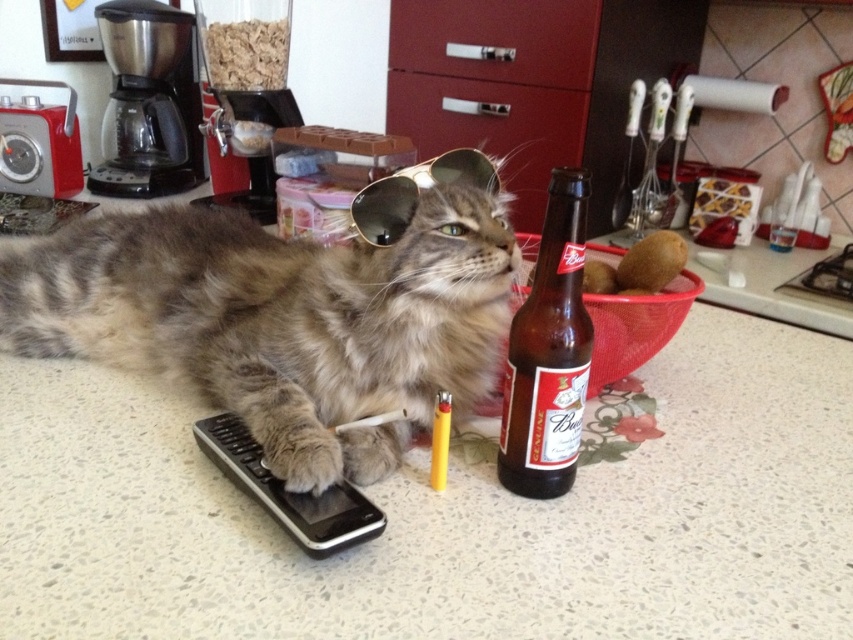
Does fuzzy fur cat at center appear on the right side of matte plastic drawer at upper center?

In fact, fuzzy fur cat at center is to the left of matte plastic drawer at upper center.

Who is positioned more to the left, fuzzy fur cat at center or matte plastic drawer at upper center?

From the viewer's perspective, fuzzy fur cat at center appears more on the left side.

Where is `fuzzy fur cat at center`? fuzzy fur cat at center is located at coordinates (280, 320).

Find the location of `fuzzy fur cat at center`. fuzzy fur cat at center is located at coordinates (280, 320).

Can you confirm if white speckled countertop at center is taller than brushed metal coffee machine at upper left?

No.

Who is lower down, white speckled countertop at center or brushed metal coffee machine at upper left?

white speckled countertop at center is lower down.

Is point (3, 483) closer to viewer compared to point (236, 33)?

Yes.

The width and height of the screenshot is (853, 640). I want to click on white speckled countertop at center, so click(x=450, y=515).

Which is in front, point (138, 141) or point (521, 12)?

Point (521, 12) is in front.

Does black plastic coffee maker at upper left appear on the left side of matte red drawer at center?

Correct, you'll find black plastic coffee maker at upper left to the left of matte red drawer at center.

Does point (146, 6) lie in front of point (402, 6)?

Yes, point (146, 6) is closer to viewer.

Where is `black plastic coffee maker at upper left`? black plastic coffee maker at upper left is located at coordinates (148, 100).